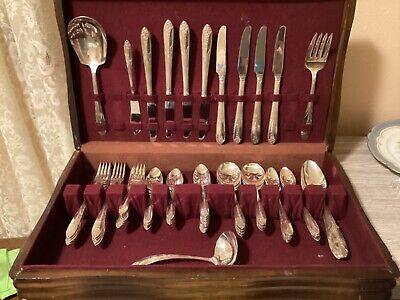
This screenshot has width=400, height=300. In order to click on spoons in this screenshot , I will do `click(309, 180)`, `click(293, 178)`, `click(274, 178)`, `click(259, 179)`, `click(229, 177)`, `click(205, 178)`, `click(182, 179)`, `click(158, 180)`.